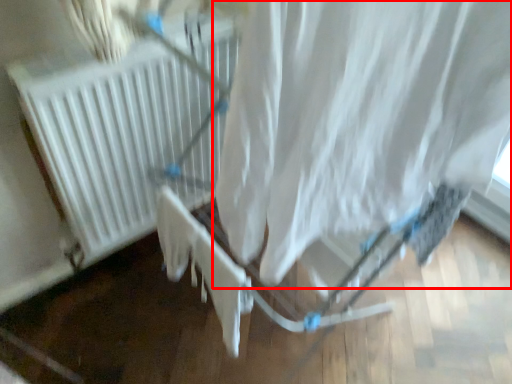
Question: From the image, what is the correct spatial relationship of curtain (annotated by the red box) in relation to heater?

Choices:
 (A) left
 (B) right

Answer: (B)